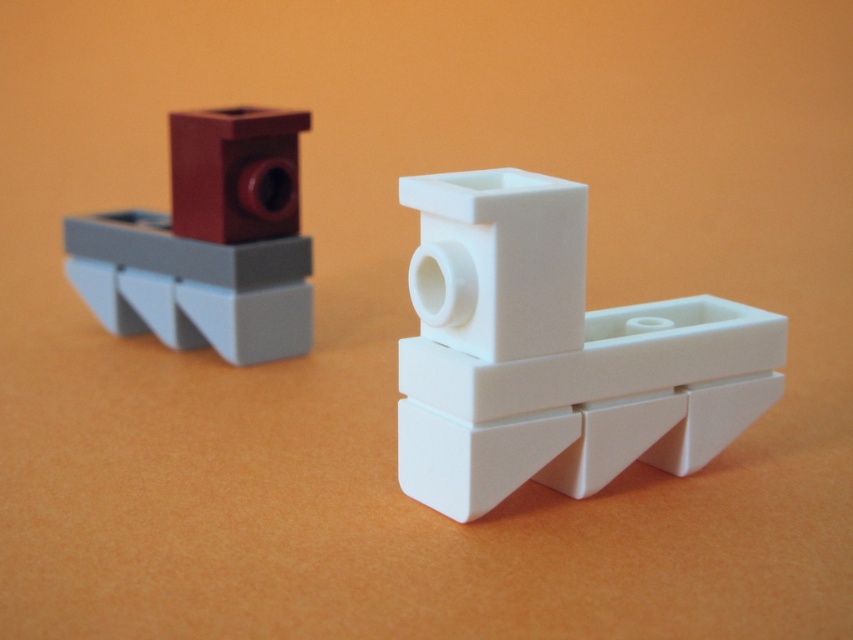
Is white plastic boat at center shorter than matte red brick at upper left?

Correct, white plastic boat at center is not as tall as matte red brick at upper left.

Is point (548, 248) behind point (132, 227)?

No, it is in front of (132, 227).

Locate an element on the screen. Image resolution: width=853 pixels, height=640 pixels. white plastic boat at center is located at coordinates (555, 353).